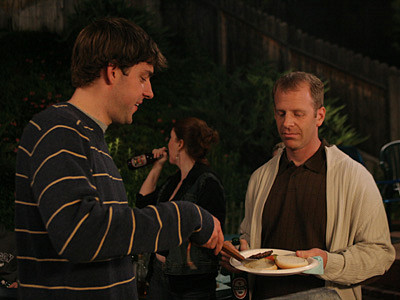
Image resolution: width=400 pixels, height=300 pixels. Find the location of `plate`. plate is located at coordinates (283, 271).